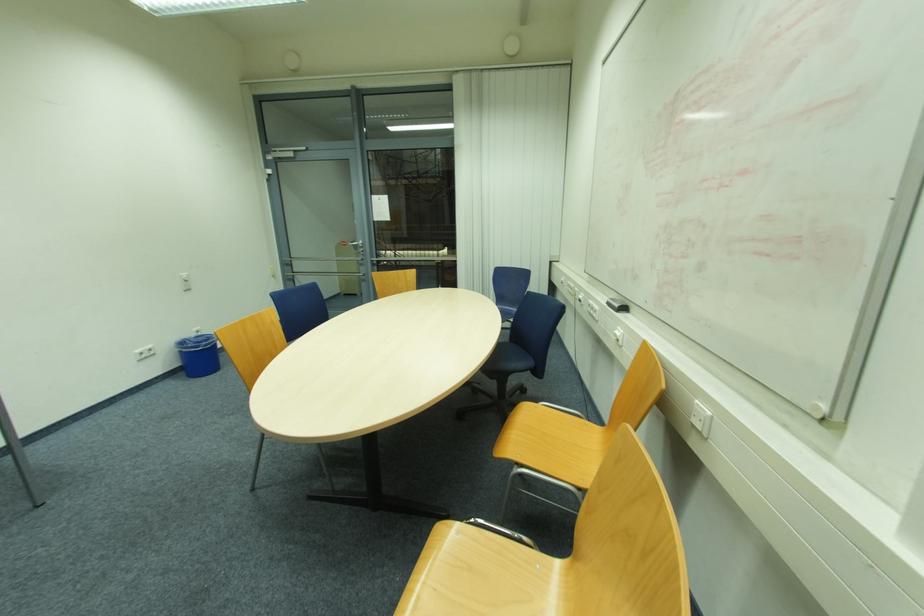
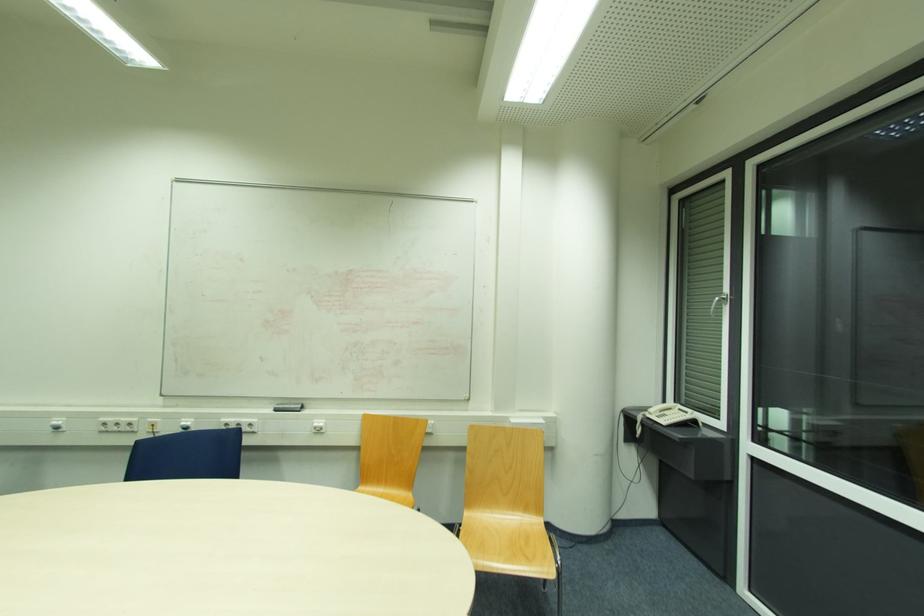
In the second image, find the point that corresponds to [611,305] in the first image.

(276, 411)